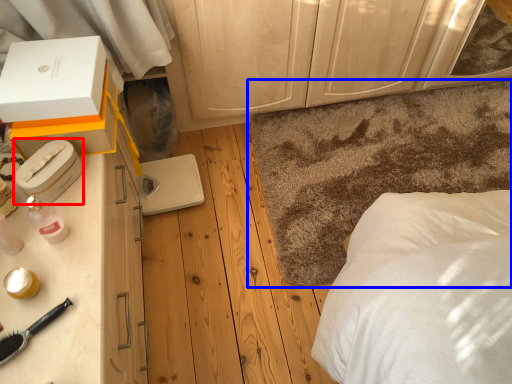
Question: Which point is further to the camera, box (highlighted by a red box) or mat (highlighted by a blue box)?

Choices:
 (A) box
 (B) mat

Answer: (B)